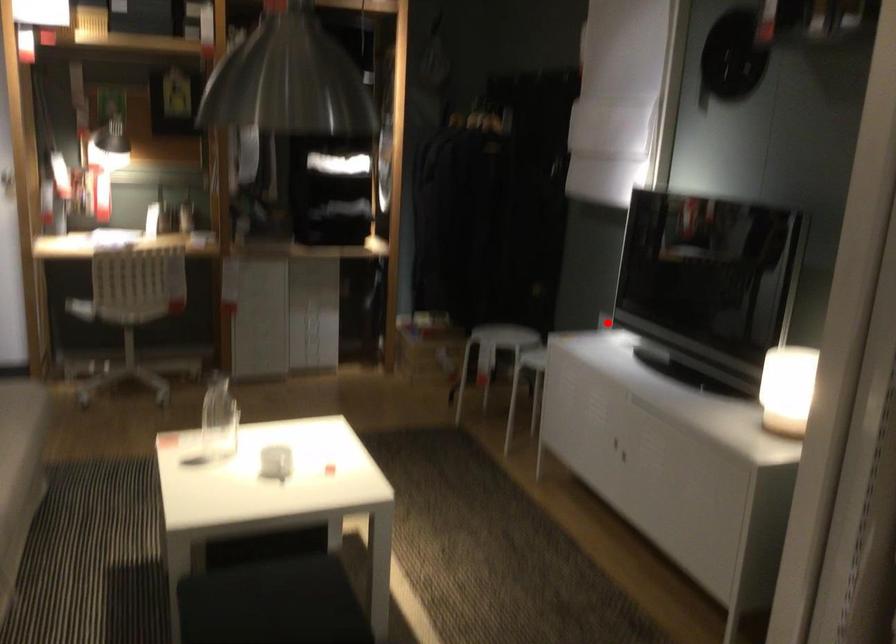
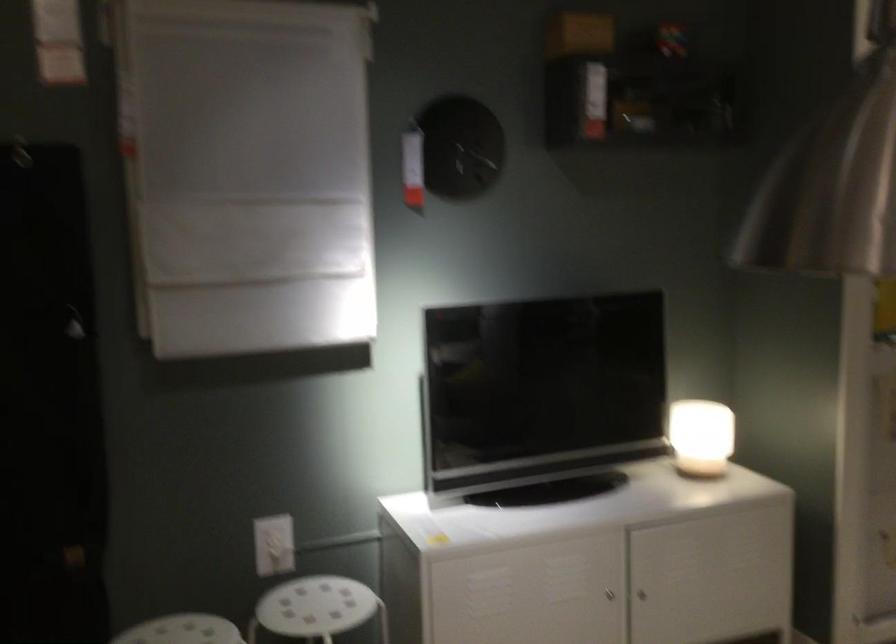
Question: I am providing you with two images of the same scene from different viewpoints. Given a red point in image1, look at the same physical point in image2. Is it:

Choices:
 (A) Closer to the viewpoint
 (B) Farther from the viewpoint

Answer: (A)